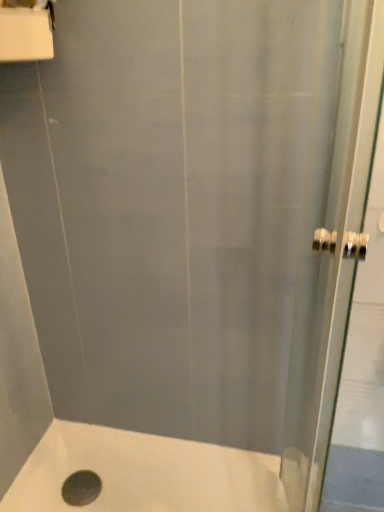
Where is `white matte bath at lower left`? The width and height of the screenshot is (384, 512). white matte bath at lower left is located at coordinates (145, 473).

Describe the element at coordinates (145, 473) in the screenshot. This screenshot has width=384, height=512. I see `white matte bath at lower left` at that location.

This screenshot has width=384, height=512. In order to click on white matte bath at lower left in this screenshot , I will do `click(145, 473)`.